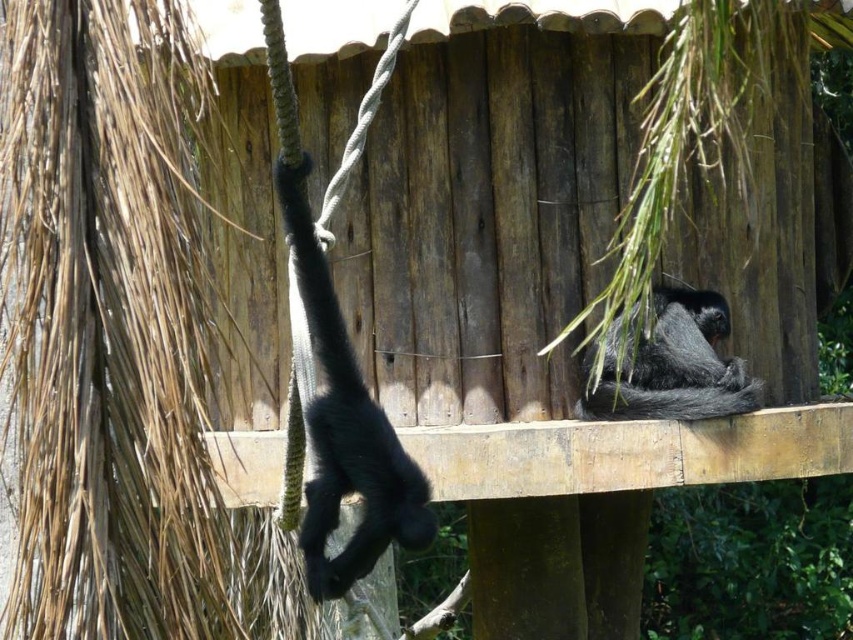
Question: Does black matte/glossy monkey at left have a smaller size compared to shiny black monkey at center?

Choices:
 (A) yes
 (B) no

Answer: (A)

Question: Is black matte/glossy monkey at left bigger than shiny black monkey at center?

Choices:
 (A) no
 (B) yes

Answer: (A)

Question: In this image, where is black matte/glossy monkey at left located relative to shiny black monkey at center?

Choices:
 (A) below
 (B) above

Answer: (A)